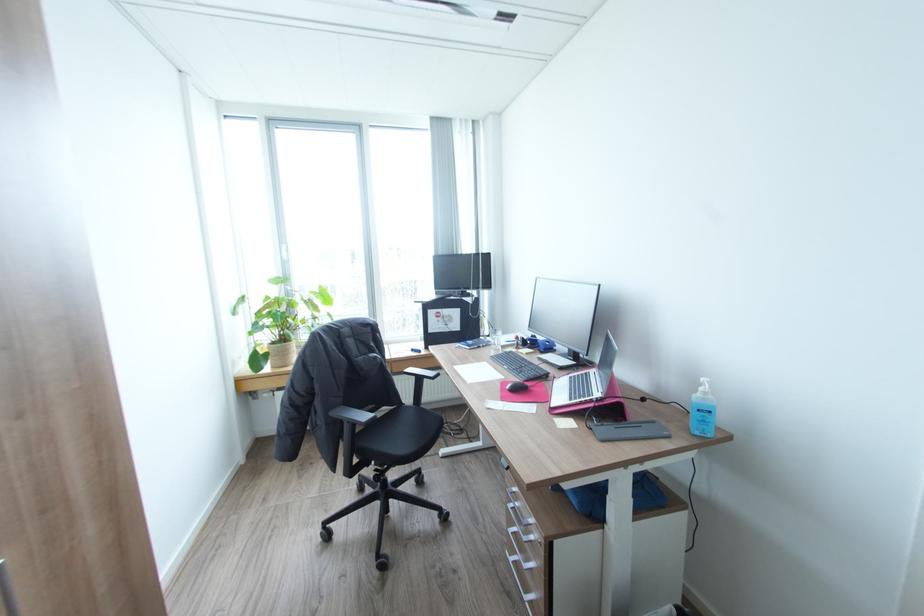
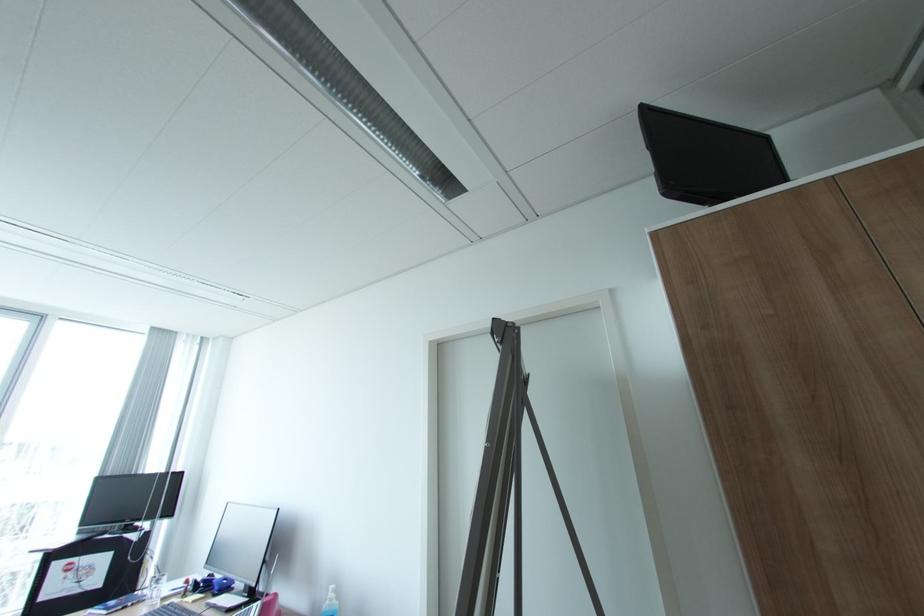
The point at (546, 347) is marked in the first image. Where is the corresponding point in the second image?

(222, 588)